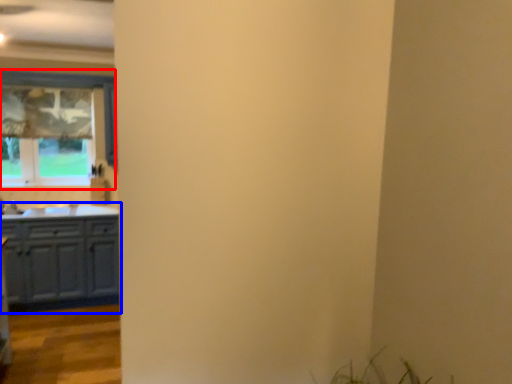
Question: Which object appears closest to the camera in this image, window (highlighted by a red box) or cabinetry (highlighted by a blue box)?

Choices:
 (A) window
 (B) cabinetry

Answer: (B)